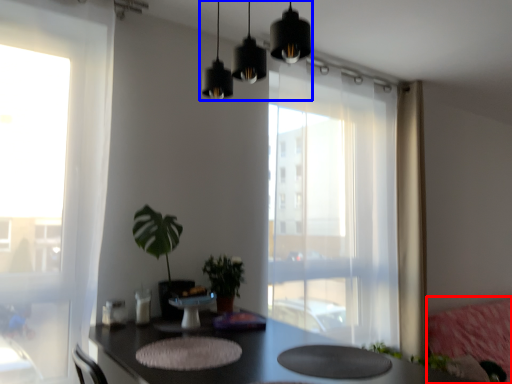
Question: Which object is closer to the camera taking this photo, couch (highlighted by a red box) or lighting (highlighted by a blue box)?

Choices:
 (A) couch
 (B) lighting

Answer: (B)